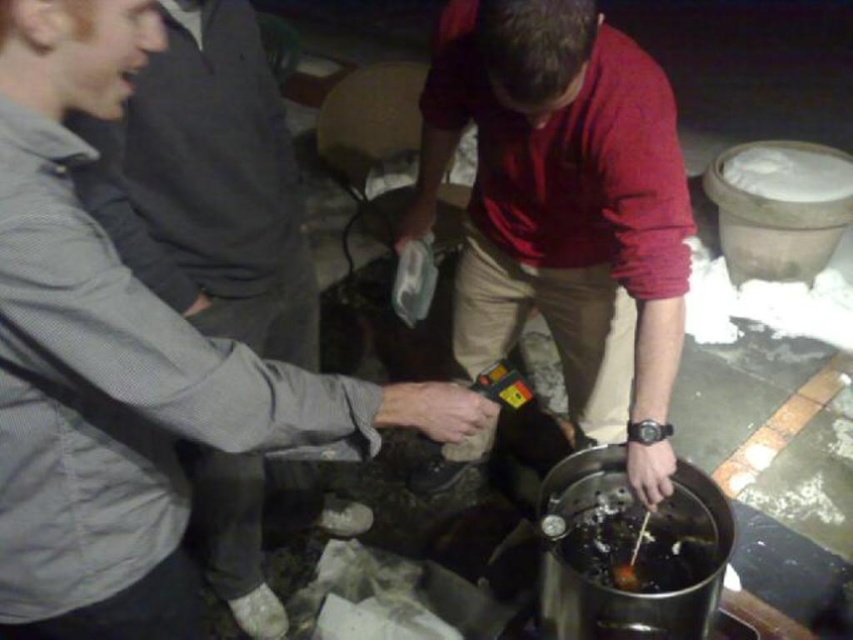
Question: Does matte red shirt at center appear on the right side of brown matte food at center?

Choices:
 (A) no
 (B) yes

Answer: (A)

Question: Among these objects, which one is nearest to the camera?

Choices:
 (A) brown matte food at center
 (B) gray fabric jacket at left

Answer: (B)

Question: Can you confirm if gray fabric jacket at left is positioned below brown matte food at center?

Choices:
 (A) yes
 (B) no

Answer: (B)

Question: Which of these objects is positioned farthest from the gray fabric jacket at left?

Choices:
 (A) matte red shirt at center
 (B) brown matte food at center

Answer: (B)

Question: Which point appears farthest from the camera in this image?

Choices:
 (A) (589, 513)
 (B) (535, 268)

Answer: (A)

Question: Is matte red shirt at center bigger than brown matte food at center?

Choices:
 (A) no
 (B) yes

Answer: (B)